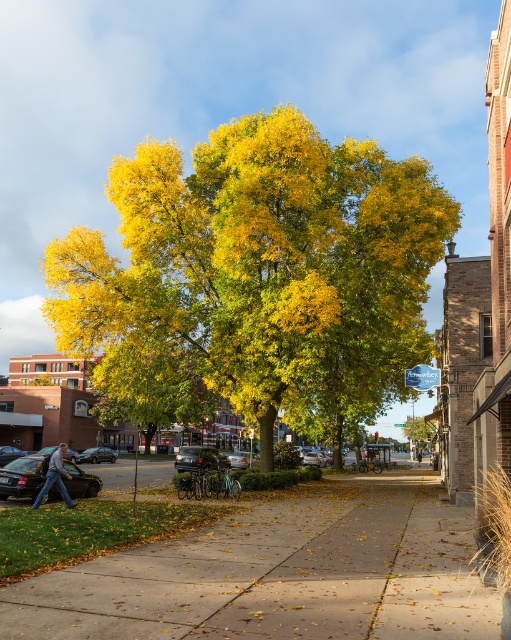
You are standing at the center of the sidewalk and see the point labeled as point (265, 268). What color is the foliage at that point?

The foliage at point (265, 268) is yellow and green.